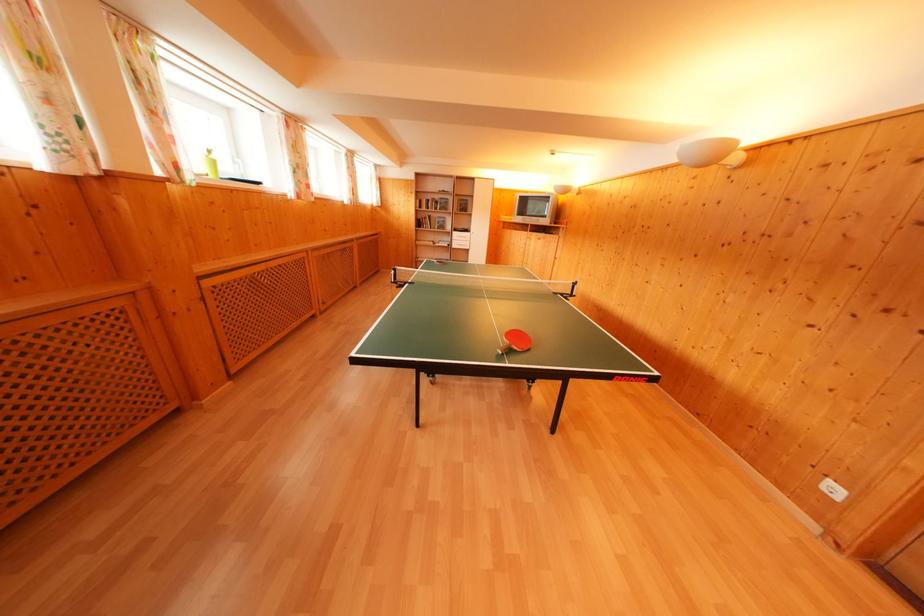
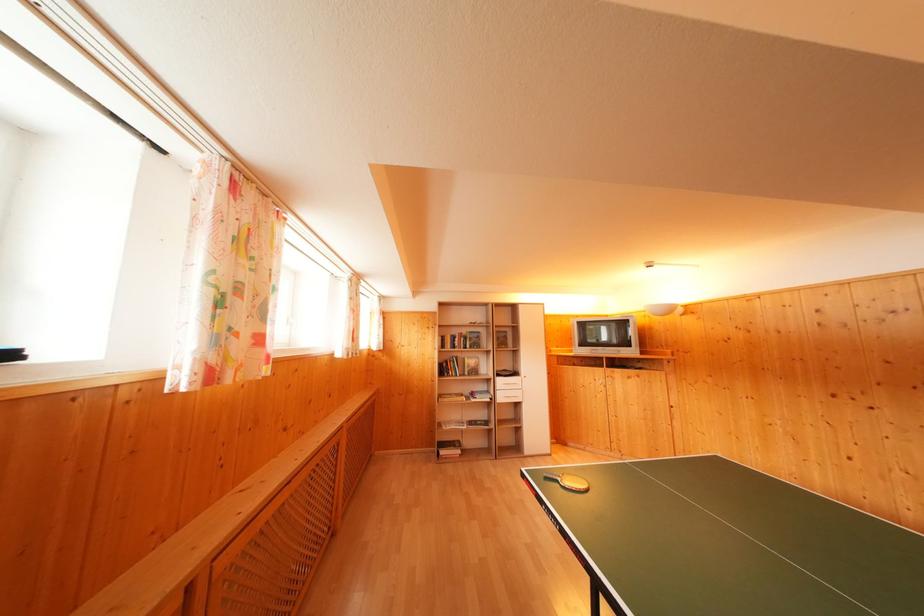
Which direction would the cameraman need to move to produce the second image?

The cameraman moved toward left, forward.